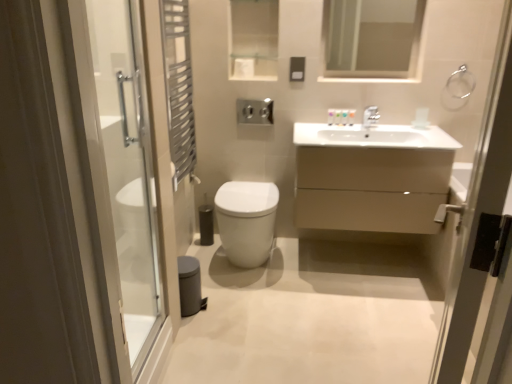
Question: Is matte beige cabinet at center taller than metallic silver towel ring at right, the first screen door positioned from the right?

Choices:
 (A) yes
 (B) no

Answer: (B)

Question: Is matte beige cabinet at center oriented towards metallic silver towel ring at right, which ranks as the second screen door in left-to-right order?

Choices:
 (A) yes
 (B) no

Answer: (A)

Question: From the image's perspective, would you say matte beige cabinet at center is shown under metallic silver towel ring at right, the first screen door positioned from the right?

Choices:
 (A) no
 (B) yes

Answer: (A)

Question: Considering the relative sizes of matte beige cabinet at center and metallic silver towel ring at right, the first screen door positioned from the right, in the image provided, is matte beige cabinet at center wider than metallic silver towel ring at right, the first screen door positioned from the right,?

Choices:
 (A) no
 (B) yes

Answer: (B)

Question: Is matte beige cabinet at center not inside metallic silver towel ring at right, which ranks as the second screen door in left-to-right order?

Choices:
 (A) no
 (B) yes

Answer: (B)

Question: From the image's perspective, is metallic silver towel ring at right, which ranks as the second screen door in left-to-right order, above or below silver metallic towel ring at upper right?

Choices:
 (A) above
 (B) below

Answer: (B)

Question: Considering the positions of metallic silver towel ring at right, which ranks as the second screen door in left-to-right order, and silver metallic towel ring at upper right in the image, is metallic silver towel ring at right, which ranks as the second screen door in left-to-right order, taller or shorter than silver metallic towel ring at upper right?

Choices:
 (A) tall
 (B) short

Answer: (A)

Question: Based on their sizes in the image, would you say metallic silver towel ring at right, the first screen door positioned from the right, is bigger or smaller than silver metallic towel ring at upper right?

Choices:
 (A) big
 (B) small

Answer: (A)

Question: In the image, is metallic silver towel ring at right, the first screen door positioned from the right, on the left side or the right side of silver metallic towel ring at upper right?

Choices:
 (A) left
 (B) right

Answer: (A)

Question: In terms of size, does transparent glass shower door at left, the first screen door from the left, appear bigger or smaller than silver metallic towel ring at upper right?

Choices:
 (A) small
 (B) big

Answer: (B)

Question: Is transparent glass shower door at left, the first screen door from the left, taller or shorter than silver metallic towel ring at upper right?

Choices:
 (A) tall
 (B) short

Answer: (A)

Question: Is transparent glass shower door at left, the first screen door from the left, in front of or behind silver metallic towel ring at upper right in the image?

Choices:
 (A) behind
 (B) front

Answer: (B)

Question: From a real-world perspective, relative to silver metallic towel ring at upper right, is transparent glass shower door at left, the first screen door from the left, vertically above or below?

Choices:
 (A) above
 (B) below

Answer: (B)

Question: From the image's perspective, is metallic silver towel ring at right, the first screen door positioned from the right, above or below clear glass mirror at upper center?

Choices:
 (A) below
 (B) above

Answer: (A)

Question: Considering their positions, is metallic silver towel ring at right, which ranks as the second screen door in left-to-right order, located in front of or behind clear glass mirror at upper center?

Choices:
 (A) behind
 (B) front

Answer: (B)